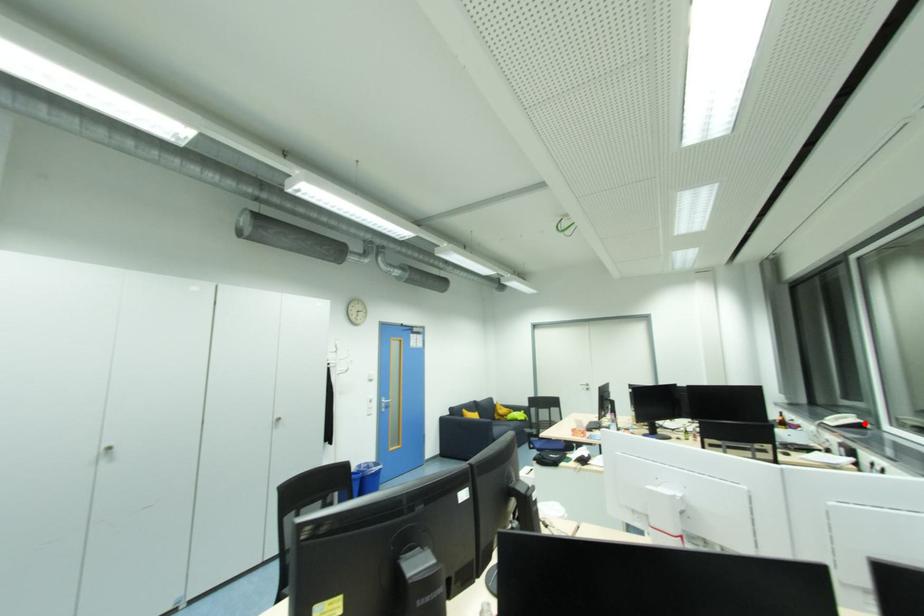
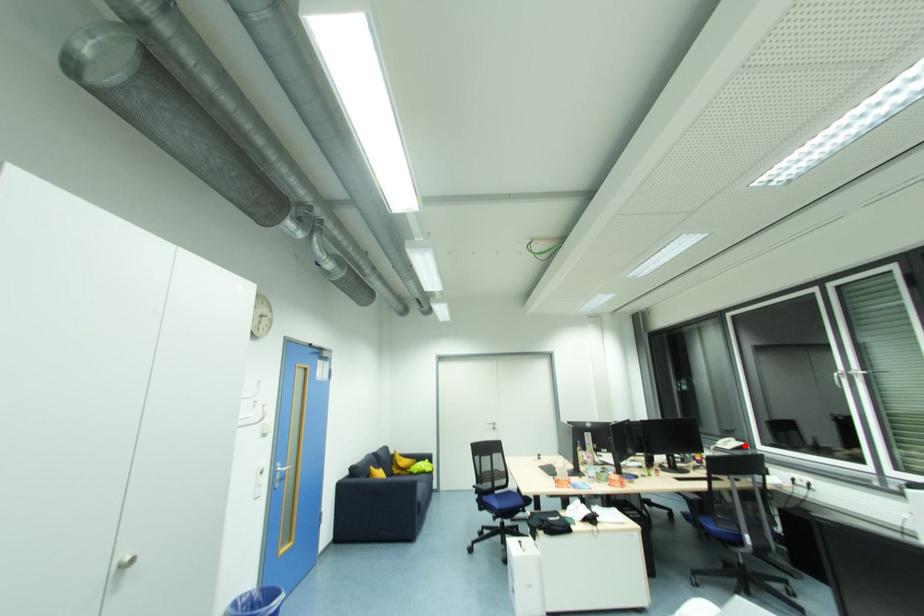
I am providing you with two images of the same scene from different viewpoints. A red point is marked on the first image and another point is marked on the second image. Does the point marked in image1 correspond to the same location as the one in image2?

Yes